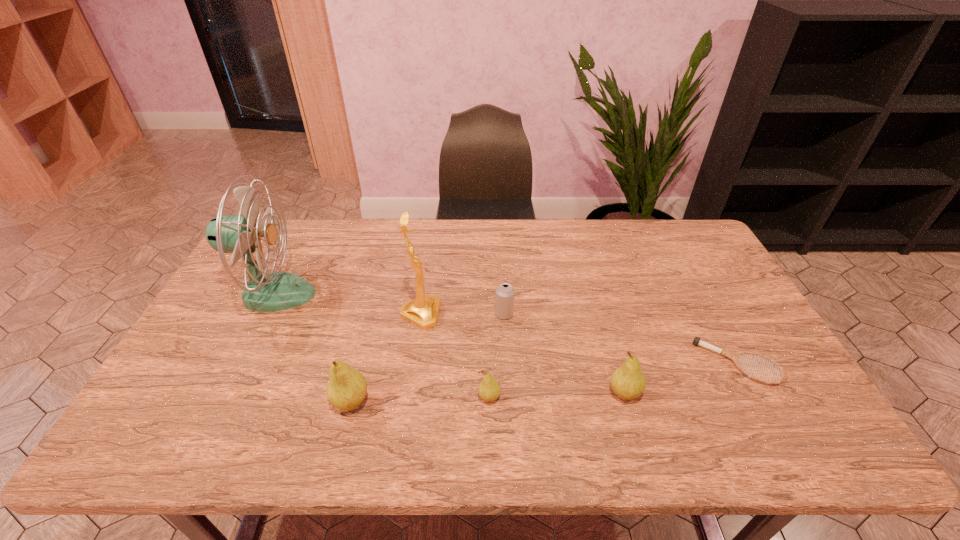
Find the location of a particular element. vacant position in the image that satisfies the following two spatial constraints: 1. in front of the beer can, directing airflow; 2. on the right side of the leftmost object is located at coordinates (265, 314).

Find the location of `vacant space that satisfies the following two spatial constraints: 1. in front of the second object from left to right, directing airflow; 2. on the left side of the fan`. vacant space that satisfies the following two spatial constraints: 1. in front of the second object from left to right, directing airflow; 2. on the left side of the fan is located at coordinates (220, 402).

The image size is (960, 540). What are the coordinates of `vacant point that satisfies the following two spatial constraints: 1. on the front-facing side of the third object from left to right; 2. on the right side of the fourth tallest object` in the screenshot? It's located at (410, 394).

The height and width of the screenshot is (540, 960). What are the coordinates of `vacant region that satisfies the following two spatial constraints: 1. on the back side of the shortest object; 2. on the left side of the fourth tallest object` in the screenshot? It's located at (615, 363).

The width and height of the screenshot is (960, 540). Identify the location of vacant area that satisfies the following two spatial constraints: 1. in front of the leftmost object, directing airflow; 2. on the back side of the shortest object. (240, 363).

At what (x,y) coordinates should I click in order to perform the action: click on free space that satisfies the following two spatial constraints: 1. on the back side of the second shortest pear; 2. on the front-facing side of the third object from left to right. Please return your answer as a coordinate pair (x, y). The width and height of the screenshot is (960, 540). Looking at the image, I should click on (602, 315).

This screenshot has height=540, width=960. Identify the location of free spot that satisfies the following two spatial constraints: 1. on the back side of the sixth object from left to right; 2. on the right side of the sixth object from right to left. (353, 394).